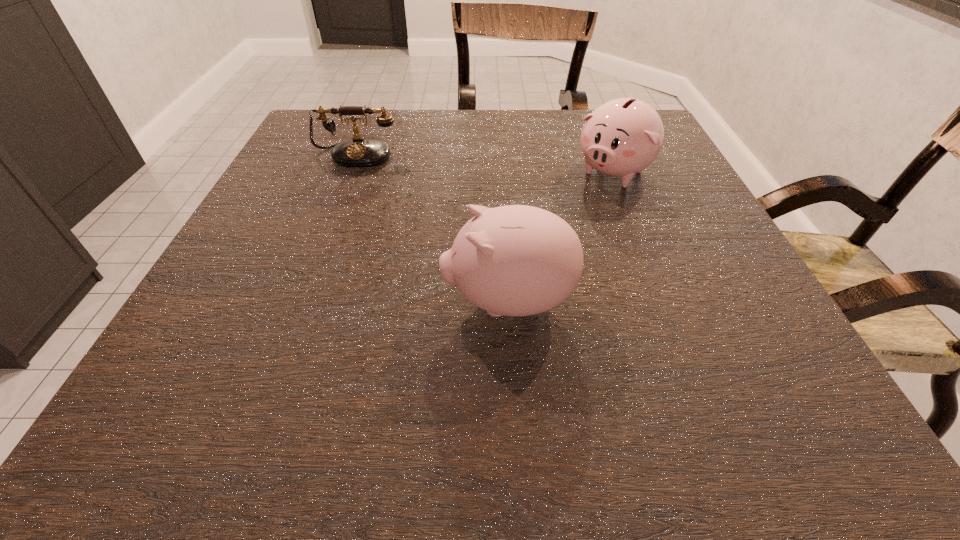
At what (x,y) coordinates should I click in order to perform the action: click on free spot that satisfies the following two spatial constraints: 1. on the dial of the right piggy bank; 2. on the right side of the shortest object. Please return your answer as a coordinate pair (x, y). This screenshot has height=540, width=960. Looking at the image, I should click on (350, 173).

Locate an element on the screen. The height and width of the screenshot is (540, 960). free location that satisfies the following two spatial constraints: 1. on the front side of the farther piggy bank; 2. at the snout of the nearest object is located at coordinates (664, 301).

Where is `blank area in the image that satisfies the following two spatial constraints: 1. on the dial of the telephone; 2. on the left side of the farther piggy bank`? Image resolution: width=960 pixels, height=540 pixels. blank area in the image that satisfies the following two spatial constraints: 1. on the dial of the telephone; 2. on the left side of the farther piggy bank is located at coordinates (350, 173).